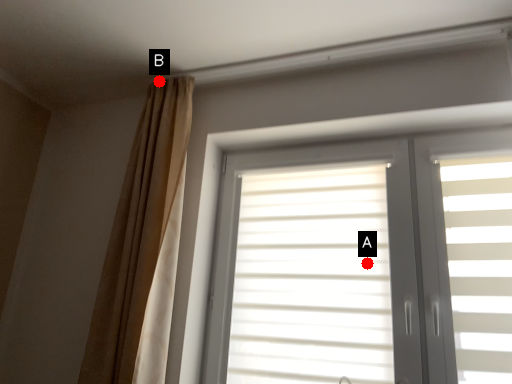
Question: Two points are circled on the image, labeled by A and B beside each circle. Which of the following is the closest to the observer?

Choices:
 (A) A is closer
 (B) B is closer

Answer: (A)